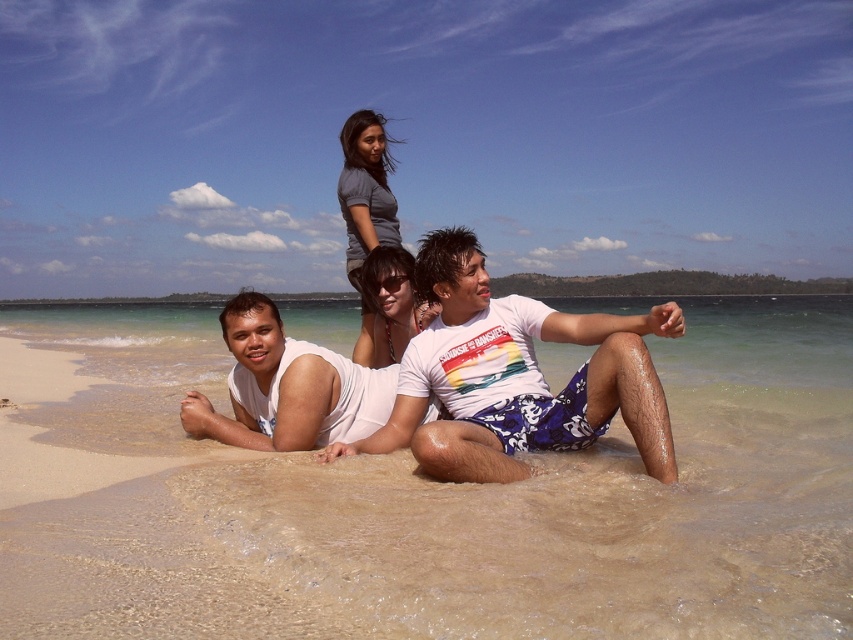
Does white matte t-shirt at center have a larger size compared to gray matte shirt at upper center?

Incorrect, white matte t-shirt at center is not larger than gray matte shirt at upper center.

Which is in front, point (323, 440) or point (386, 356)?

Positioned in front is point (323, 440).

The image size is (853, 640). What do you see at coordinates (287, 387) in the screenshot?
I see `white matte t-shirt at center` at bounding box center [287, 387].

I want to click on white matte t-shirt at center, so click(x=287, y=387).

How distant is white printed t-shirt at center from gray matte shirt at upper center?

white printed t-shirt at center is 5.35 feet away from gray matte shirt at upper center.

Does white printed t-shirt at center have a lesser width compared to gray matte shirt at upper center?

In fact, white printed t-shirt at center might be wider than gray matte shirt at upper center.

Is point (672, 456) in front of point (372, 164)?

Yes.

Where is `white printed t-shirt at center`? white printed t-shirt at center is located at coordinates (515, 376).

Which is more to the left, sandy beach at lower center or gray matte shirt at upper center?

sandy beach at lower center is more to the left.

Is sandy beach at lower center to the left of gray matte shirt at upper center from the viewer's perspective?

Indeed, sandy beach at lower center is positioned on the left side of gray matte shirt at upper center.

The image size is (853, 640). Identify the location of sandy beach at lower center. (440, 529).